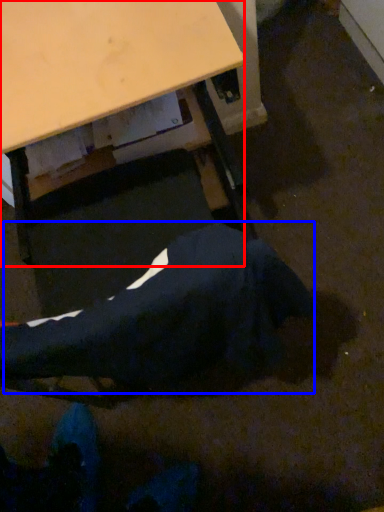
Question: Which object is closer to the camera taking this photo, desk (highlighted by a red box) or robe (highlighted by a blue box)?

Choices:
 (A) desk
 (B) robe

Answer: (B)